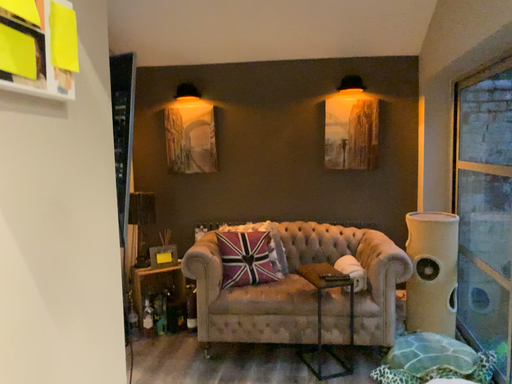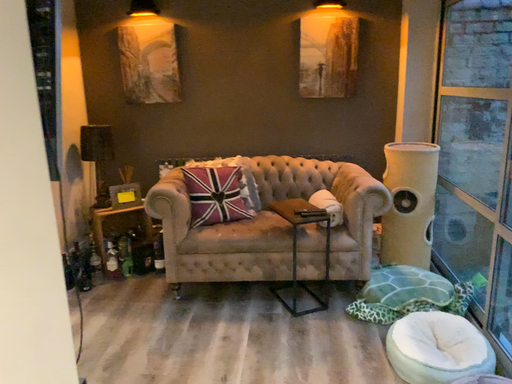
Question: How did the camera likely rotate when shooting the video?

Choices:
 (A) rotated upward
 (B) rotated downward

Answer: (B)